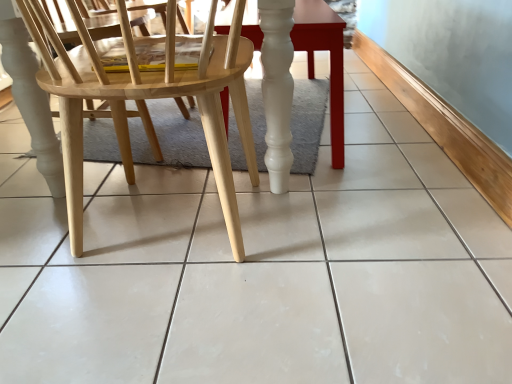
The image size is (512, 384). I want to click on unoccupied space behind natural wood chair at left, so click(x=156, y=158).